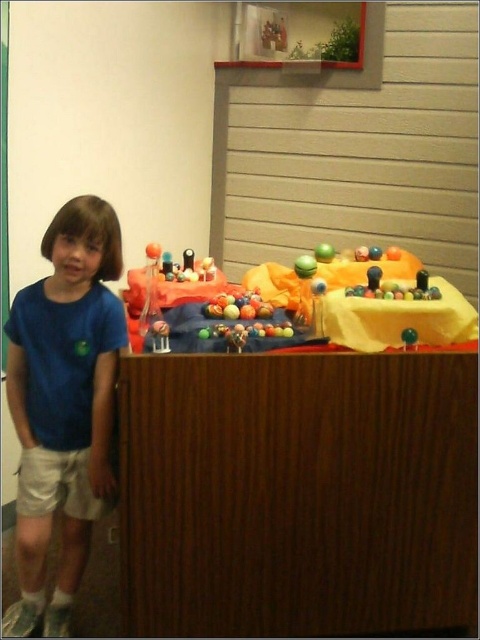
Which is more to the left, white cotton shorts at lower left or glossy plastic balls at center?

From the viewer's perspective, white cotton shorts at lower left appears more on the left side.

Is white cotton shorts at lower left positioned in front of glossy plastic balls at center?

Yes.

You are a GUI agent. You are given a task and a screenshot of the screen. Output one action in this format:
    pyautogui.click(x=<x>, y=<y>)
    Task: Click on the white cotton shorts at lower left
    The height and width of the screenshot is (640, 480).
    Given the screenshot: What is the action you would take?
    pyautogui.click(x=57, y=484)

Is wooden table at center to the right of glossy plastic balls at center from the viewer's perspective?

Correct, you'll find wooden table at center to the right of glossy plastic balls at center.

Between wooden table at center and glossy plastic balls at center, which one has more height?

wooden table at center is taller.

The width and height of the screenshot is (480, 640). In order to click on wooden table at center in this screenshot , I will do `click(298, 493)`.

Can you confirm if shiny metallic balls at center is positioned above glossy plastic balls at center?

Yes.

Describe the element at coordinates (394, 288) in the screenshot. I see `shiny metallic balls at center` at that location.

Identify the location of shiny metallic balls at center. This screenshot has width=480, height=640. (394, 288).